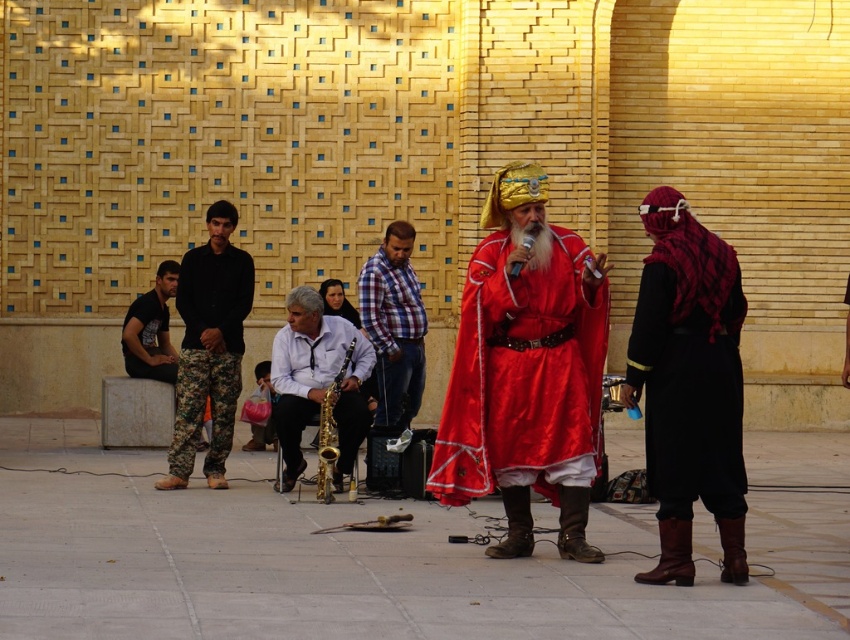
Question: Can you confirm if black woolen robe at right is wider than gold shiny saxophone at center?

Choices:
 (A) yes
 (B) no

Answer: (B)

Question: Which point appears farthest from the camera in this image?

Choices:
 (A) (319, 481)
 (B) (466, 476)

Answer: (A)

Question: Is satin red robe at center above gold metallic saxophone at center?

Choices:
 (A) yes
 (B) no

Answer: (A)

Question: Based on their relative distances, which object is farther from the plaid fabric shirt at center?

Choices:
 (A) gold shiny saxophone at center
 (B) camouflage pants at left

Answer: (B)

Question: Which of the following is the farthest from the observer?

Choices:
 (A) (299, 410)
 (B) (332, 483)

Answer: (B)

Question: Is black cotton shirt at left wider than gold metallic saxophone at center?

Choices:
 (A) yes
 (B) no

Answer: (A)